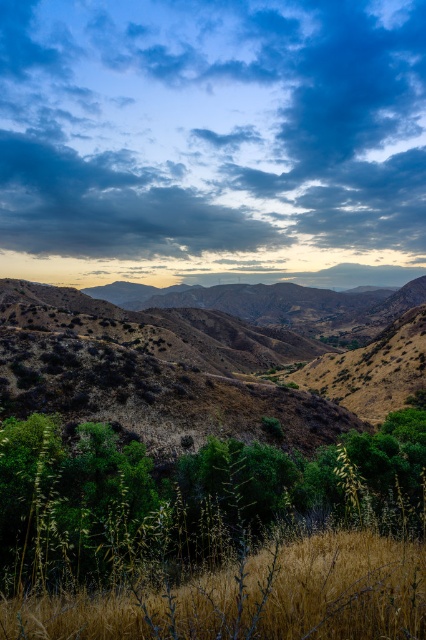
Question: Which of the following is the closest to the observer?

Choices:
 (A) (351, 440)
 (B) (290, 65)
 (C) (132, 632)

Answer: (C)

Question: Is cloudy sky at upper center above green leafy tree at lower left?

Choices:
 (A) no
 (B) yes

Answer: (B)

Question: Which of these objects is positioned closest to the dry grass at lower center?

Choices:
 (A) cloudy sky at upper center
 (B) green leafy tree at lower left

Answer: (B)

Question: From the image, what is the correct spatial relationship of green leafy tree at lower left in relation to dry grass at lower center?

Choices:
 (A) below
 (B) above

Answer: (A)

Question: Estimate the real-world distances between objects in this image. Which object is closer to the cloudy sky at upper center?

Choices:
 (A) green leafy tree at lower left
 (B) dry grass at lower center

Answer: (A)

Question: From the image, what is the correct spatial relationship of green leafy tree at lower left in relation to dry grass at lower center?

Choices:
 (A) below
 (B) above

Answer: (A)